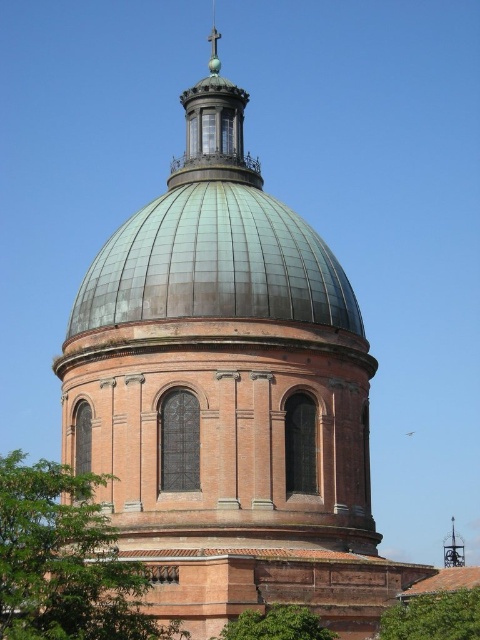
Is green leafy tree at lower left thinner than green leafy tree at lower center?

No, green leafy tree at lower left is not thinner than green leafy tree at lower center.

Consider the image. Does green leafy tree at lower left have a greater height compared to green leafy tree at lower center?

Correct, green leafy tree at lower left is much taller as green leafy tree at lower center.

This screenshot has height=640, width=480. I want to click on green leafy tree at lower left, so click(x=66, y=561).

Identify the location of green leafy tree at lower left. This screenshot has height=640, width=480. (66, 561).

Who is lower down, green leafy tree at lower right or green leafy tree at lower center?

green leafy tree at lower center is below.

At what (x,y) coordinates should I click in order to perform the action: click on green leafy tree at lower right. Please return your answer as a coordinate pair (x, y). This screenshot has height=640, width=480. Looking at the image, I should click on (433, 616).

Which is behind, point (1, 624) or point (408, 604)?

Point (408, 604)

This screenshot has width=480, height=640. What do you see at coordinates (66, 561) in the screenshot?
I see `green leafy tree at lower left` at bounding box center [66, 561].

Locate an element on the screen. This screenshot has height=640, width=480. green leafy tree at lower left is located at coordinates (66, 561).